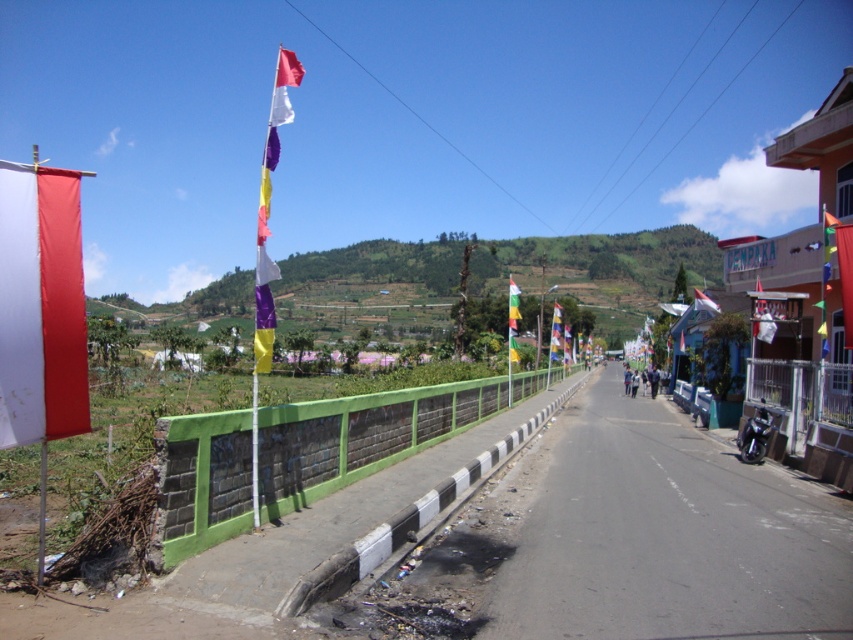
You are a photographer standing at the starting point of the rural road. You want to capture both the white fabric flag at left and the multicolored fabric flag at center in a single wide shot. Considering the distance between them, do you think you can fit both flags into your camera frame without moving your position?

The distance between the white fabric flag at left and the multicolored fabric flag at center is 38.42 meters. Depending on your camera lens, a wide angle lens might be necessary to capture both flags in a single frame from your current position.

You are standing at the starting point of the rural road and want to reach the point marked by point (56,186) and point (764,442). Which point is closer to you?

Point (56,186) is in front of point (764,442), so it is closer to you.

You are standing at the center of the road and want to find the white fabric flag at left. Based on the coordinates provided, in which direction should you look to locate it?

The white fabric flag at left is located at coordinates point (39, 307), which means it is positioned to the left side of the road. Therefore, you should look to your left to find it.